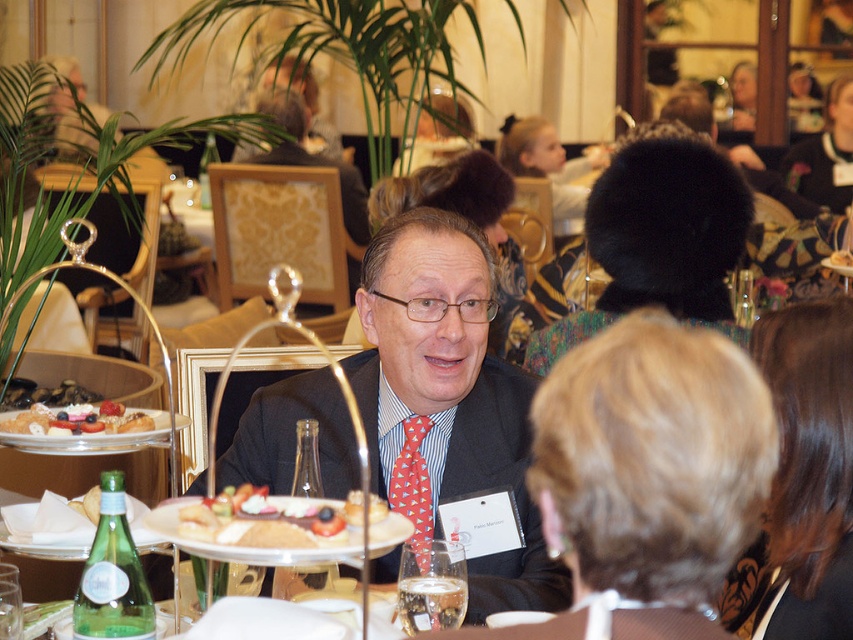
Question: Is smooth cream cheese spread at center bigger than clear glass wine glass at lower center?

Choices:
 (A) no
 (B) yes

Answer: (B)

Question: Which of the following is the farthest from the observer?

Choices:
 (A) matte black suit at center
 (B) smooth cream cheese spread at center
 (C) golden brown cake at center
 (D) red silk tie at center

Answer: (C)

Question: Can you confirm if matte black suit at center is positioned to the right of chocolate cake at center?

Choices:
 (A) no
 (B) yes

Answer: (A)

Question: Which object appears farthest from the camera in this image?

Choices:
 (A) smooth cream cheese spread at center
 (B) clear glass wine glass at lower center
 (C) smooth cream cake at left

Answer: (C)

Question: Where is matte black suit at center located in relation to red silk tie at center in the image?

Choices:
 (A) above
 (B) below

Answer: (A)

Question: Which of these objects is positioned farthest from the smooth cream cheese spread at center?

Choices:
 (A) chocolate cake at center
 (B) clear glass wine glass at lower center
 (C) matte black suit at center

Answer: (C)